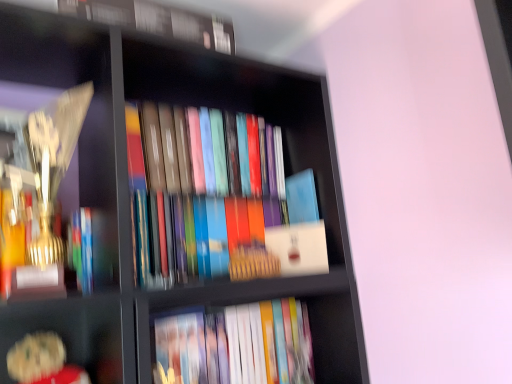
Question: From a real-world perspective, is matte hardcover book at lower center, placed as the second book when sorted from top to bottom, above or below blue matte book at center, which is counted as the 2th paperback book, starting from the bottom?

Choices:
 (A) above
 (B) below

Answer: (B)

Question: Would you say matte hardcover book at lower center, which is the 1th book in bottom-to-top order, is inside or outside blue matte book at center, which is counted as the 2th paperback book, starting from the bottom?

Choices:
 (A) inside
 (B) outside

Answer: (B)

Question: Which object is the closest to the blue matte book at center, marked as the 1th paperback book in a top-to-bottom arrangement?

Choices:
 (A) white matte book at center, the first paperback book in the bottom-to-top sequence
 (B) hardcover book at upper center, acting as the 1th book starting from the top
 (C) matte hardcover book at lower center, which is the 1th book in bottom-to-top order

Answer: (A)

Question: Which object is positioned closest to the blue matte book at center, which is counted as the 2th paperback book, starting from the bottom?

Choices:
 (A) hardcover book at upper center, acting as the 1th book starting from the top
 (B) white matte book at center, arranged as the 2th paperback book when viewed from the top
 (C) matte hardcover book at lower center, placed as the second book when sorted from top to bottom

Answer: (B)